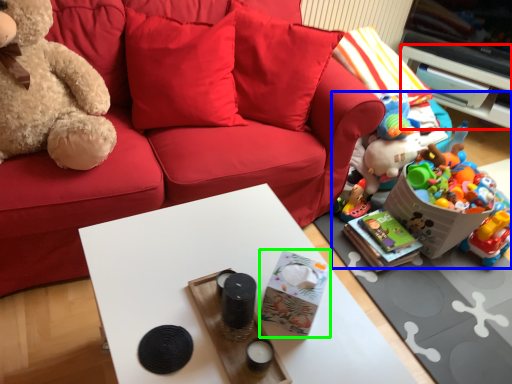
Question: Estimate the real-world distances between objects in this image. Which object is closer to cabinetry (highlighted by a red box), toy (highlighted by a blue box) or box (highlighted by a green box)?

Choices:
 (A) toy
 (B) box

Answer: (A)